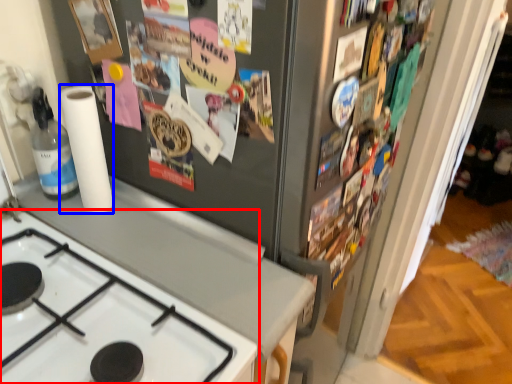
Question: Which of the following is the farthest to the observer, gas stove (highlighted by a red box) or paper towel (highlighted by a blue box)?

Choices:
 (A) gas stove
 (B) paper towel

Answer: (B)